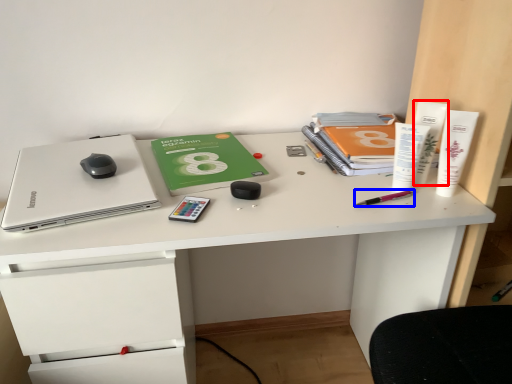
Question: Which object is further to the camera taking this photo, stationery (highlighted by a red box) or stationery (highlighted by a blue box)?

Choices:
 (A) stationery
 (B) stationery

Answer: (A)